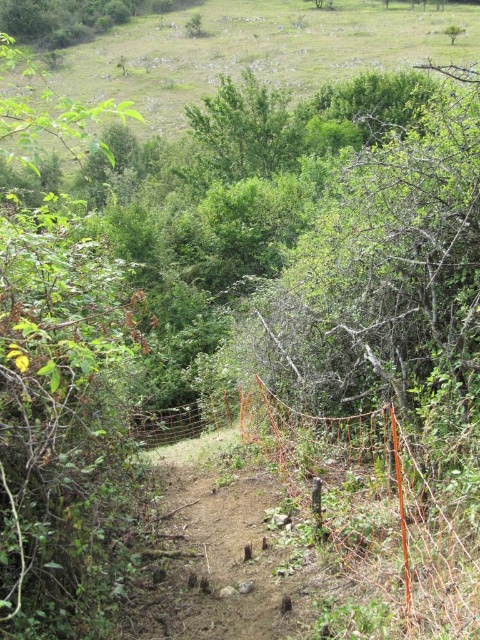
Question: Can you confirm if orange wire mesh at center is wider than orange mesh fence at center?

Choices:
 (A) yes
 (B) no

Answer: (B)

Question: Among these points, which one is farthest from the camera?

Choices:
 (A) (228, 410)
 (B) (384, 435)

Answer: (A)

Question: Which point is farther to the camera?

Choices:
 (A) (184, 422)
 (B) (315, 436)

Answer: (A)

Question: Does orange wire mesh at center have a lesser width compared to orange mesh fence at center?

Choices:
 (A) yes
 (B) no

Answer: (A)

Question: Which of the following is the closest to the observer?

Choices:
 (A) orange wire mesh at center
 (B) orange mesh fence at center

Answer: (A)

Question: Is orange wire mesh at center to the right of orange mesh fence at center from the viewer's perspective?

Choices:
 (A) yes
 (B) no

Answer: (A)